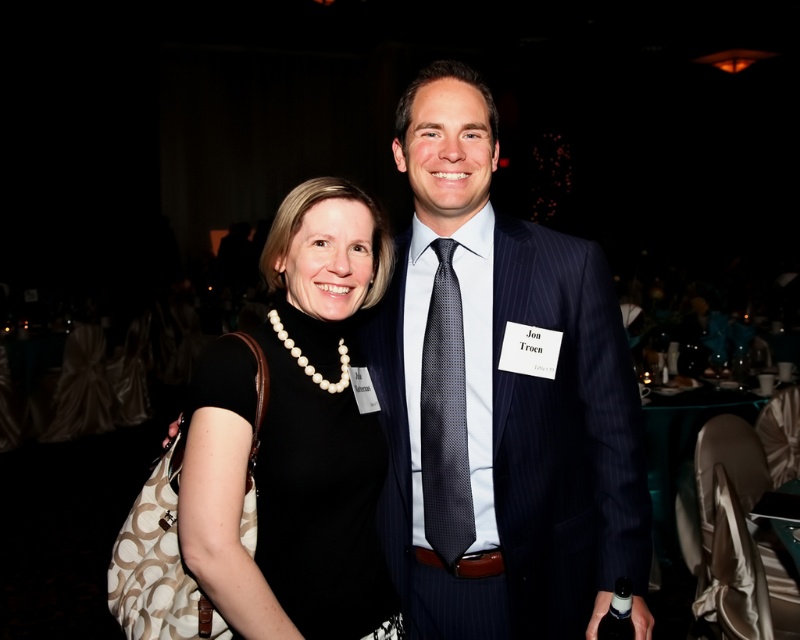
Question: Which of the following is the farthest from the observer?

Choices:
 (A) dark blue pinstripe suit at center
 (B) black dotted tie at center
 (C) black matte dress at center

Answer: (B)

Question: Does dark blue pinstripe suit at center appear on the right side of black dotted tie at center?

Choices:
 (A) yes
 (B) no

Answer: (A)

Question: In this image, where is dark blue pinstripe suit at center located relative to black dotted tie at center?

Choices:
 (A) right
 (B) left

Answer: (A)

Question: Is dark blue pinstripe suit at center closer to the viewer compared to black dotted tie at center?

Choices:
 (A) yes
 (B) no

Answer: (A)

Question: Which of these objects is positioned closest to the black dotted tie at center?

Choices:
 (A) black matte dress at center
 (B) dark blue pinstripe suit at center

Answer: (B)

Question: Estimate the real-world distances between objects in this image. Which object is farther from the dark blue pinstripe suit at center?

Choices:
 (A) black matte dress at center
 (B) black dotted tie at center

Answer: (A)